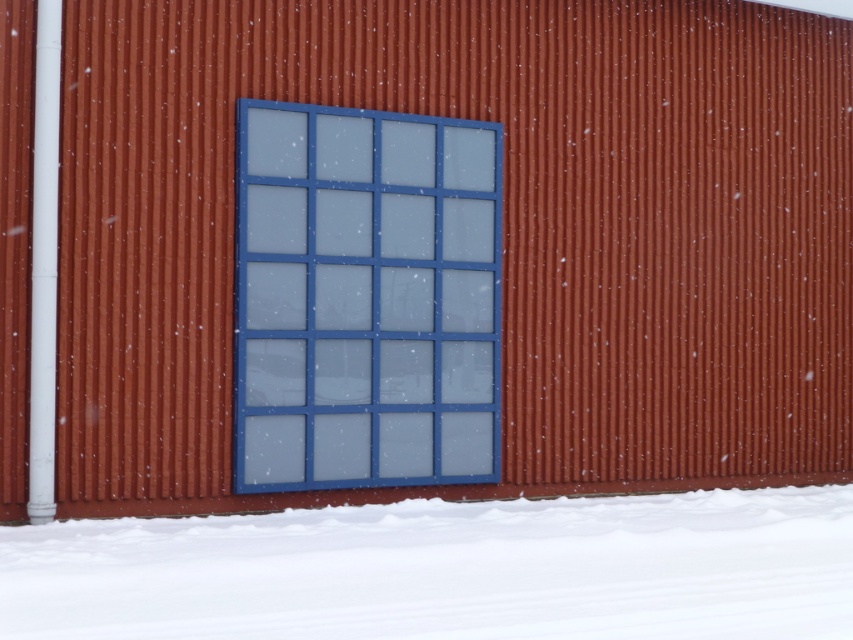
You are standing in front of the building and want to touch the white powdery snow at lower center and the blue glass window at center. Which one can you reach without moving your feet?

The white powdery snow at lower center is closer to the viewer than the blue glass window at center, so you can reach the white powdery snow at lower center without moving your feet.

You are standing in front of the building and want to walk to the white powdery snow at lower center. Which direction should you move relative to the blue glass window at center?

You should move to the right of the blue glass window at center because the white powdery snow at lower center is located to the right of it.

You are an architect designing a new building and want to ensure the white powdery snow at lower center and blue glass window at center are proportionally balanced. Given their sizes, which object should you adjust to achieve better balance?

The white powdery snow at lower center occupies less space than the blue glass window at center, so you should increase the size of the white powdery snow at lower center to match the blue glass window at center for better balance.